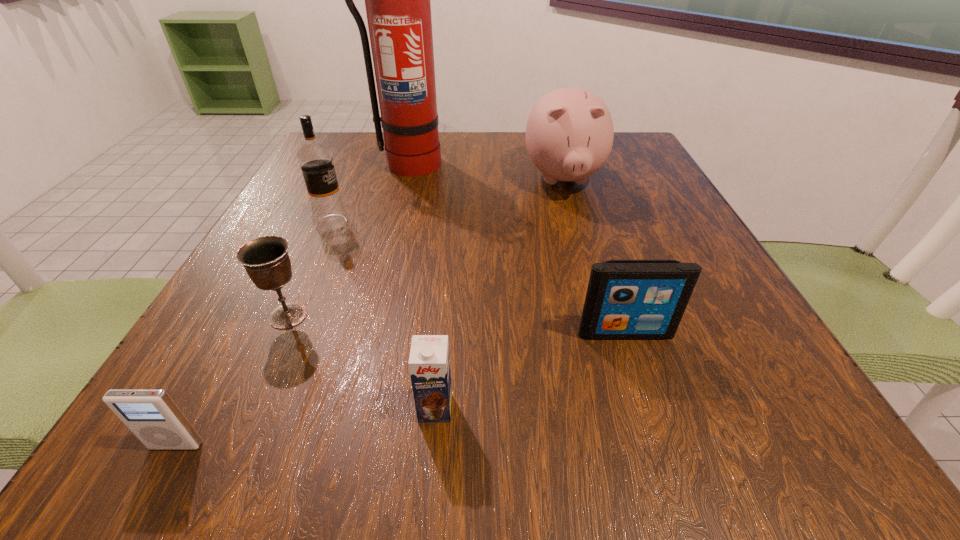
The width and height of the screenshot is (960, 540). In order to click on fire extinguisher in this screenshot , I will do `click(397, 0)`.

Identify the location of vodka. pos(315,159).

The image size is (960, 540). In order to click on piggy bank in this screenshot , I will do `click(569, 134)`.

What are the coordinates of `the right iPod` in the screenshot? It's located at (626, 299).

You are a GUI agent. You are given a task and a screenshot of the screen. Output one action in this format:
    pyautogui.click(x=<x>, y=<y>)
    Task: Click on the farther iPod
    This screenshot has height=540, width=960.
    Given the screenshot: What is the action you would take?
    pyautogui.click(x=626, y=299)

Where is `chalice`? chalice is located at coordinates click(x=266, y=260).

Identify the location of the sixth farthest object. The height and width of the screenshot is (540, 960). (429, 363).

Where is `the third object from right to left`? the third object from right to left is located at coordinates (429, 363).

You are a GUI agent. You are given a task and a screenshot of the screen. Output one action in this format:
    pyautogui.click(x=<x>, y=<y>)
    Task: Click on the shortest object
    The width and height of the screenshot is (960, 540).
    Given the screenshot: What is the action you would take?
    pyautogui.click(x=151, y=415)

Locate an element on the screen. This screenshot has height=540, width=960. the shorter iPod is located at coordinates (151, 415).